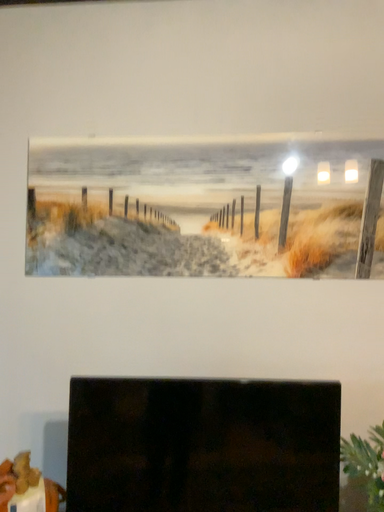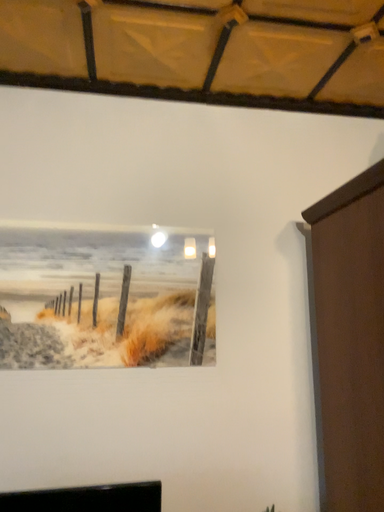
Question: How did the camera likely rotate when shooting the video?

Choices:
 (A) rotated right
 (B) rotated left

Answer: (A)